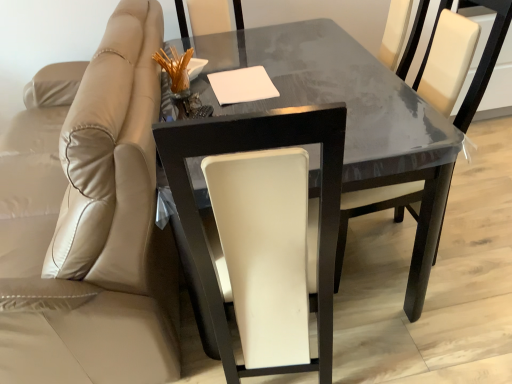
Question: Does point (376, 195) appear closer or farther from the camera than point (194, 3)?

Choices:
 (A) closer
 (B) farther

Answer: (A)

Question: Looking at their shapes, would you say white leather chair at center, the third chair when ordered from left to right, is wider or thinner than white leather chair at center, which ranks as the second chair in right-to-left order?

Choices:
 (A) wide
 (B) thin

Answer: (A)

Question: Which object is positioned farthest from the glossy dark wood table at center?

Choices:
 (A) beige leather chair at left, which appears as the third chair when viewed from the right
 (B) white leather chair at center, the third chair when ordered from left to right
 (C) white leather chair at center, placed as the 2th chair when sorted from left to right

Answer: (C)

Question: Estimate the real-world distances between objects in this image. Which object is closer to the glossy dark wood table at center?

Choices:
 (A) white leather chair at center, positioned as the first chair in right-to-left order
 (B) beige leather chair at left, which appears as the third chair when viewed from the right
 (C) white leather chair at center, placed as the 2th chair when sorted from left to right

Answer: (A)